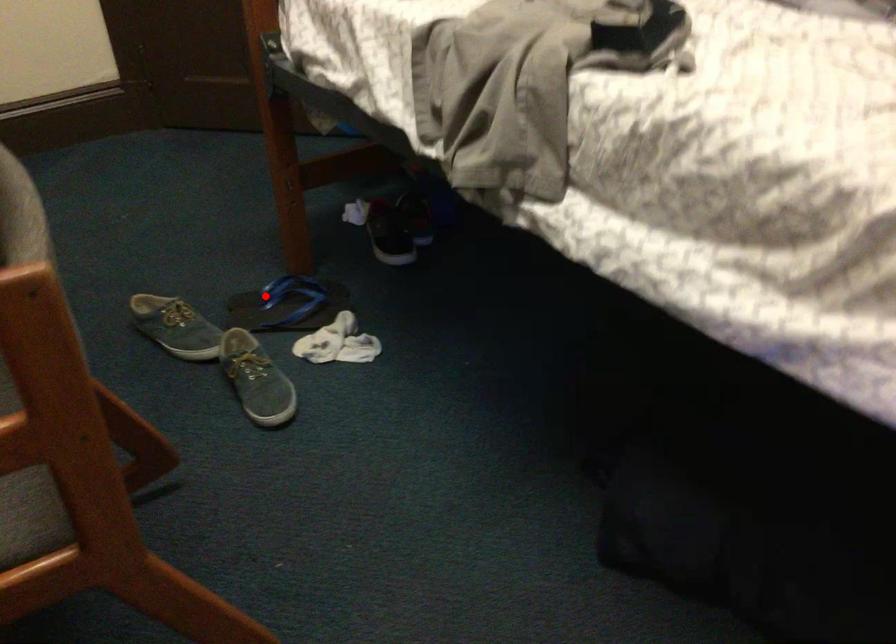
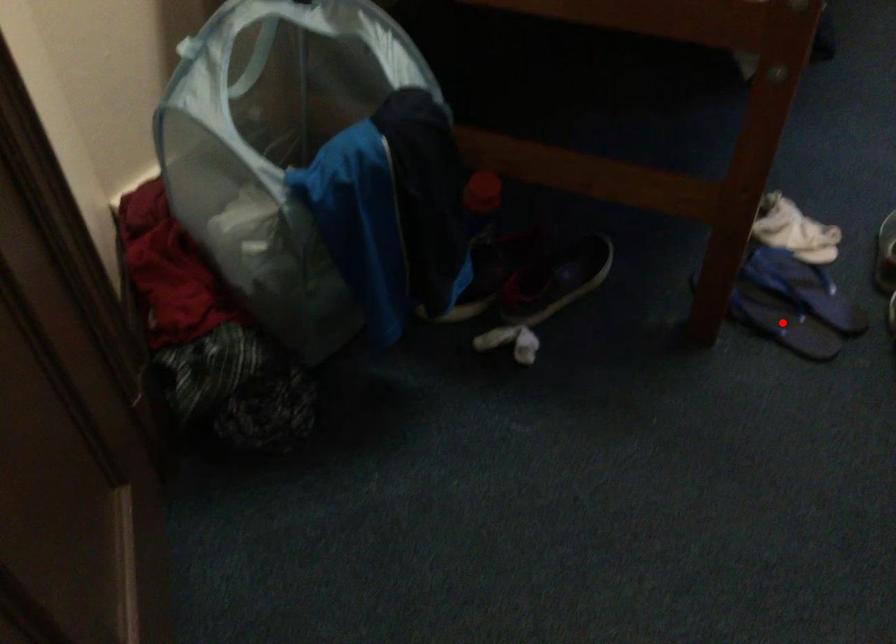
I am providing you with two images of the same scene from different viewpoints. A red point is marked on the first image and another point is marked on the second image. Are the points marked in image1 and image2 representing the same 3D position?

Yes